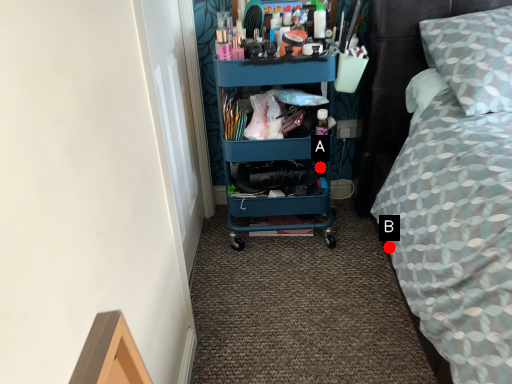
Question: Two points are circled on the image, labeled by A and B beside each circle. Which point appears farthest from the camera in this image?

Choices:
 (A) A is further
 (B) B is further

Answer: (A)